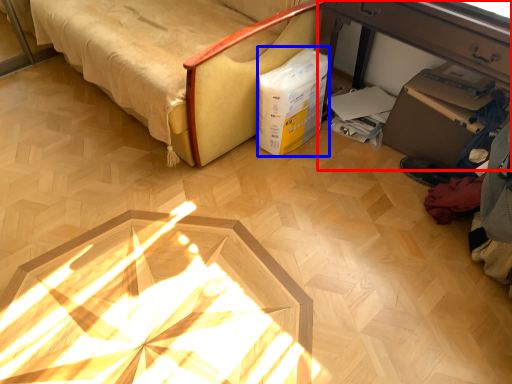
Question: Among these objects, which one is farthest to the camera, table (highlighted by a red box) or box (highlighted by a blue box)?

Choices:
 (A) table
 (B) box

Answer: (B)